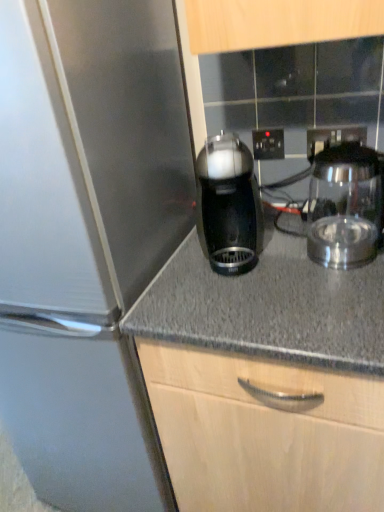
What is the approximate width of black plastic coffee maker at center, acting as the first kitchen appliance starting from the left?

black plastic coffee maker at center, acting as the first kitchen appliance starting from the left, is 5.00 inches wide.

The width and height of the screenshot is (384, 512). In order to click on black plastic electric outlet at upper center, which appears as the second electric outlet when viewed from the back in this screenshot , I will do `click(319, 141)`.

Does point (307, 133) come closer to viewer compared to point (211, 214)?

No, (307, 133) is behind (211, 214).

Does black plastic electric outlet at upper center, which is the 1th electric outlet in front-to-back order, have a lesser height compared to black plastic coffee maker at center, which appears as the second kitchen appliance when viewed from the right?

Indeed, black plastic electric outlet at upper center, which is the 1th electric outlet in front-to-back order, has a lesser height compared to black plastic coffee maker at center, which appears as the second kitchen appliance when viewed from the right.

In the scene shown: Between black plastic electric outlet at upper center, which is the first electric outlet from right to left, and black plastic coffee maker at center, which appears as the second kitchen appliance when viewed from the right, which one has smaller width?

black plastic electric outlet at upper center, which is the first electric outlet from right to left.

Is black plastic electric outlet at upper center, which appears as the second electric outlet when viewed from the back, with black plastic coffee maker at center, which appears as the second kitchen appliance when viewed from the right?

No, black plastic electric outlet at upper center, which appears as the second electric outlet when viewed from the back, is not touching black plastic coffee maker at center, which appears as the second kitchen appliance when viewed from the right.

Which object is wider, black plastic coffee maker at center, which appears as the second kitchen appliance when viewed from the right, or black plastic electric outlet at upper center, which appears as the second electric outlet when viewed from the left?

black plastic coffee maker at center, which appears as the second kitchen appliance when viewed from the right.

Is black plastic coffee maker at center, which appears as the second kitchen appliance when viewed from the right, facing towards black plastic electric outlet at upper center, which appears as the second electric outlet when viewed from the left?

No, black plastic coffee maker at center, which appears as the second kitchen appliance when viewed from the right, does not turn towards black plastic electric outlet at upper center, which appears as the second electric outlet when viewed from the left.

Does black plastic coffee maker at center, acting as the first kitchen appliance starting from the left, lie behind black plastic electric outlet at upper center, which appears as the second electric outlet when viewed from the left?

No, the depth of black plastic coffee maker at center, acting as the first kitchen appliance starting from the left, is less than that of black plastic electric outlet at upper center, which appears as the second electric outlet when viewed from the left.

From a real-world perspective, is black plastic electric outlet at center, the second electric outlet positioned from the front, beneath black plastic coffee maker at center, acting as the first kitchen appliance starting from the left?

Incorrect, from a real-world perspective, black plastic electric outlet at center, the second electric outlet positioned from the front, is higher than black plastic coffee maker at center, acting as the first kitchen appliance starting from the left.

Which is nearer, (261, 154) or (217, 261)?

The point (217, 261) is more forward.

The height and width of the screenshot is (512, 384). In order to click on kitchen appliance located on the left of black plastic electric outlet at center, the second electric outlet positioned from the front in this screenshot , I will do `click(229, 205)`.

Looking at this image, considering the relative sizes of black plastic electric outlet at center, the second electric outlet positioned from the front, and black plastic coffee maker at center, acting as the first kitchen appliance starting from the left, in the image provided, is black plastic electric outlet at center, the second electric outlet positioned from the front, smaller than black plastic coffee maker at center, acting as the first kitchen appliance starting from the left,?

Correct, black plastic electric outlet at center, the second electric outlet positioned from the front, occupies less space than black plastic coffee maker at center, acting as the first kitchen appliance starting from the left.

From the image's perspective, which object appears higher, black plastic coffee maker at center, which appears as the second kitchen appliance when viewed from the right, or black plastic electric outlet at center, which ranks as the 1th electric outlet in left-to-right order?

black plastic electric outlet at center, which ranks as the 1th electric outlet in left-to-right order, is shown above in the image.

From a real-world perspective, does black plastic coffee maker at center, which appears as the second kitchen appliance when viewed from the right, stand above black plastic electric outlet at center, which ranks as the 1th electric outlet in left-to-right order?

No, from a real-world perspective, black plastic coffee maker at center, which appears as the second kitchen appliance when viewed from the right, is not on top of black plastic electric outlet at center, which ranks as the 1th electric outlet in left-to-right order.

Are black plastic coffee maker at center, acting as the first kitchen appliance starting from the left, and black plastic electric outlet at center, the second electric outlet positioned from the front, making contact?

black plastic coffee maker at center, acting as the first kitchen appliance starting from the left, and black plastic electric outlet at center, the second electric outlet positioned from the front, are not in contact.

In terms of size, does black plastic coffee maker at center, acting as the first kitchen appliance starting from the left, appear bigger or smaller than black plastic electric outlet at center, which is the 1th electric outlet in back-to-front order?

In the image, black plastic coffee maker at center, acting as the first kitchen appliance starting from the left, appears to be larger than black plastic electric outlet at center, which is the 1th electric outlet in back-to-front order.

From the picture: Is black plastic electric outlet at upper center, which appears as the second electric outlet when viewed from the left, next to black plastic electric outlet at center, which is the 1th electric outlet in back-to-front order?

No, black plastic electric outlet at upper center, which appears as the second electric outlet when viewed from the left, is not next to black plastic electric outlet at center, which is the 1th electric outlet in back-to-front order.

Considering the sizes of black plastic electric outlet at upper center, which appears as the second electric outlet when viewed from the left, and black plastic electric outlet at center, which appears as the second electric outlet when viewed from the right, in the image, is black plastic electric outlet at upper center, which appears as the second electric outlet when viewed from the left, wider or thinner than black plastic electric outlet at center, which appears as the second electric outlet when viewed from the right,?

black plastic electric outlet at upper center, which appears as the second electric outlet when viewed from the left, is wider than black plastic electric outlet at center, which appears as the second electric outlet when viewed from the right.

Looking at this image, is black plastic electric outlet at upper center, which is the 1th electric outlet in front-to-back order, aimed at black plastic electric outlet at center, which ranks as the 1th electric outlet in left-to-right order?

No, black plastic electric outlet at upper center, which is the 1th electric outlet in front-to-back order, is not turned towards black plastic electric outlet at center, which ranks as the 1th electric outlet in left-to-right order.

You are a GUI agent. You are given a task and a screenshot of the screen. Output one action in this format:
    pyautogui.click(x=<x>, y=<y>)
    Task: Click on the 1st electric outlet located above the transparent glass carafe at right, the 2th kitchen appliance in the left-to-right sequence (from a real-world perspective)
    This screenshot has height=512, width=384.
    Given the screenshot: What is the action you would take?
    pyautogui.click(x=319, y=141)

Based on the photo, does transparent glass carafe at right, the first kitchen appliance from the right, have a lesser width compared to black plastic electric outlet at upper center, which is the 1th electric outlet in front-to-back order?

No, transparent glass carafe at right, the first kitchen appliance from the right, is not thinner than black plastic electric outlet at upper center, which is the 1th electric outlet in front-to-back order.

From a real-world perspective, which object rests below the other?

transparent glass carafe at right, the 2th kitchen appliance in the left-to-right sequence, is physically lower.

In the scene shown: Which object is further away from the camera, transparent glass carafe at right, the first kitchen appliance from the right, or black plastic electric outlet at upper center, which appears as the second electric outlet when viewed from the left?

black plastic electric outlet at upper center, which appears as the second electric outlet when viewed from the left.

Can you confirm if black plastic electric outlet at center, which is the 1th electric outlet in back-to-front order, is thinner than black plastic electric outlet at upper center, which is the first electric outlet from right to left?

Yes, black plastic electric outlet at center, which is the 1th electric outlet in back-to-front order, is thinner than black plastic electric outlet at upper center, which is the first electric outlet from right to left.

Is point (270, 131) positioned after point (311, 144)?

Yes, point (270, 131) is behind point (311, 144).

Between black plastic electric outlet at center, the second electric outlet positioned from the front, and black plastic electric outlet at upper center, which is the 1th electric outlet in front-to-back order, which one has more height?

black plastic electric outlet at center, the second electric outlet positioned from the front.

Is black plastic electric outlet at center, which appears as the second electric outlet when viewed from the right, bigger than black plastic electric outlet at upper center, which is the 1th electric outlet in front-to-back order?

Yes.

You are a GUI agent. You are given a task and a screenshot of the screen. Output one action in this format:
    pyautogui.click(x=<x>, y=<y>)
    Task: Click on the kitchen appliance located on the left of black plastic electric outlet at upper center, which appears as the second electric outlet when viewed from the back
    
    Given the screenshot: What is the action you would take?
    pyautogui.click(x=229, y=205)

Find the location of a particular element. The image size is (384, 512). the 1st kitchen appliance in front when counting from the black plastic electric outlet at upper center, which appears as the second electric outlet when viewed from the left is located at coordinates (229, 205).

Considering their positions, is black plastic coffee maker at center, acting as the first kitchen appliance starting from the left, positioned closer to black plastic electric outlet at upper center, which is the first electric outlet from right to left, than black plastic electric outlet at center, which is the 1th electric outlet in back-to-front order?

black plastic electric outlet at center, which is the 1th electric outlet in back-to-front order, lies closer to black plastic electric outlet at upper center, which is the first electric outlet from right to left, than the other object.

From the image, which object appears to be farther from black plastic coffee maker at center, acting as the first kitchen appliance starting from the left, transparent glass carafe at right, the first kitchen appliance from the right, or black plastic electric outlet at upper center, which is the 1th electric outlet in front-to-back order?

black plastic electric outlet at upper center, which is the 1th electric outlet in front-to-back order, is positioned further to the anchor black plastic coffee maker at center, acting as the first kitchen appliance starting from the left.

When comparing their distances from black plastic electric outlet at upper center, which is the first electric outlet from right to left, does transparent glass carafe at right, the first kitchen appliance from the right, or black plastic electric outlet at center, which ranks as the 1th electric outlet in left-to-right order, seem closer?

Based on the image, black plastic electric outlet at center, which ranks as the 1th electric outlet in left-to-right order, appears to be nearer to black plastic electric outlet at upper center, which is the first electric outlet from right to left.

Considering their positions, is black plastic electric outlet at upper center, which is the 1th electric outlet in front-to-back order, positioned closer to transparent glass carafe at right, the 2th kitchen appliance in the left-to-right sequence, than black plastic coffee maker at center, acting as the first kitchen appliance starting from the left?

black plastic electric outlet at upper center, which is the 1th electric outlet in front-to-back order, is positioned closer to the anchor transparent glass carafe at right, the 2th kitchen appliance in the left-to-right sequence.

From the image, which object appears to be farther from black plastic electric outlet at center, which appears as the second electric outlet when viewed from the right, black plastic coffee maker at center, which appears as the second kitchen appliance when viewed from the right, or transparent glass carafe at right, the first kitchen appliance from the right?

Based on the image, black plastic coffee maker at center, which appears as the second kitchen appliance when viewed from the right, appears to be further to black plastic electric outlet at center, which appears as the second electric outlet when viewed from the right.

Based on the photo, looking at the image, which one is located closer to black plastic coffee maker at center, which appears as the second kitchen appliance when viewed from the right, black plastic electric outlet at center, which is the 1th electric outlet in back-to-front order, or black plastic electric outlet at upper center, which is the first electric outlet from right to left?

black plastic electric outlet at center, which is the 1th electric outlet in back-to-front order, lies closer to black plastic coffee maker at center, which appears as the second kitchen appliance when viewed from the right, than the other object.

When comparing their distances from transparent glass carafe at right, the 2th kitchen appliance in the left-to-right sequence, does black plastic electric outlet at center, which is the 1th electric outlet in back-to-front order, or black plastic electric outlet at upper center, which is the first electric outlet from right to left, seem further?

The object further to transparent glass carafe at right, the 2th kitchen appliance in the left-to-right sequence, is black plastic electric outlet at center, which is the 1th electric outlet in back-to-front order.

From the image, which object appears to be farther from black plastic electric outlet at center, the second electric outlet positioned from the front, black plastic coffee maker at center, which appears as the second kitchen appliance when viewed from the right, or black plastic electric outlet at upper center, which appears as the second electric outlet when viewed from the back?

black plastic coffee maker at center, which appears as the second kitchen appliance when viewed from the right, is positioned further to the anchor black plastic electric outlet at center, the second electric outlet positioned from the front.

Find the location of a particular element. electric outlet between black plastic coffee maker at center, which appears as the second kitchen appliance when viewed from the right, and black plastic electric outlet at center, which ranks as the 1th electric outlet in left-to-right order, in the front-back direction is located at coordinates (319, 141).

I want to click on kitchen appliance between transparent glass carafe at right, the 2th kitchen appliance in the left-to-right sequence, and black plastic electric outlet at center, which is the 1th electric outlet in back-to-front order, in the front-back direction, so click(229, 205).

Locate an element on the screen. The width and height of the screenshot is (384, 512). electric outlet located between transparent glass carafe at right, the 2th kitchen appliance in the left-to-right sequence, and black plastic electric outlet at center, which is the 1th electric outlet in back-to-front order, in the depth direction is located at coordinates coord(319,141).

I want to click on kitchen appliance located between transparent glass carafe at right, the first kitchen appliance from the right, and black plastic electric outlet at upper center, which appears as the second electric outlet when viewed from the back, in the depth direction, so click(229, 205).